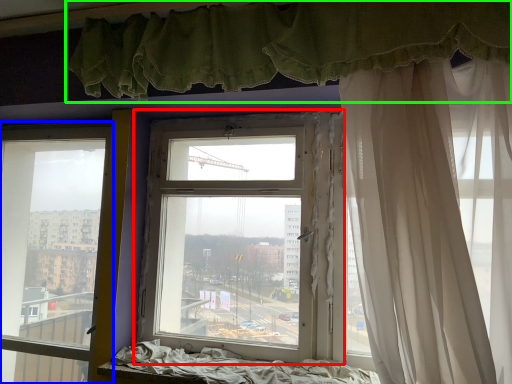
Question: Which object is the closest to the window (highlighted by a red box)? Choose among these: window (highlighted by a blue box) or curtain (highlighted by a green box).

Choices:
 (A) window
 (B) curtain

Answer: (B)